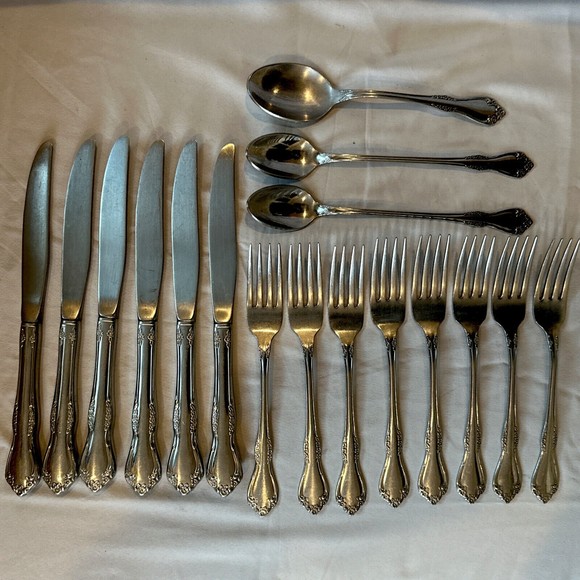
Locate an element on the screen. butter knives is located at coordinates (20, 449), (57, 463), (97, 464), (137, 467), (188, 467), (224, 469).